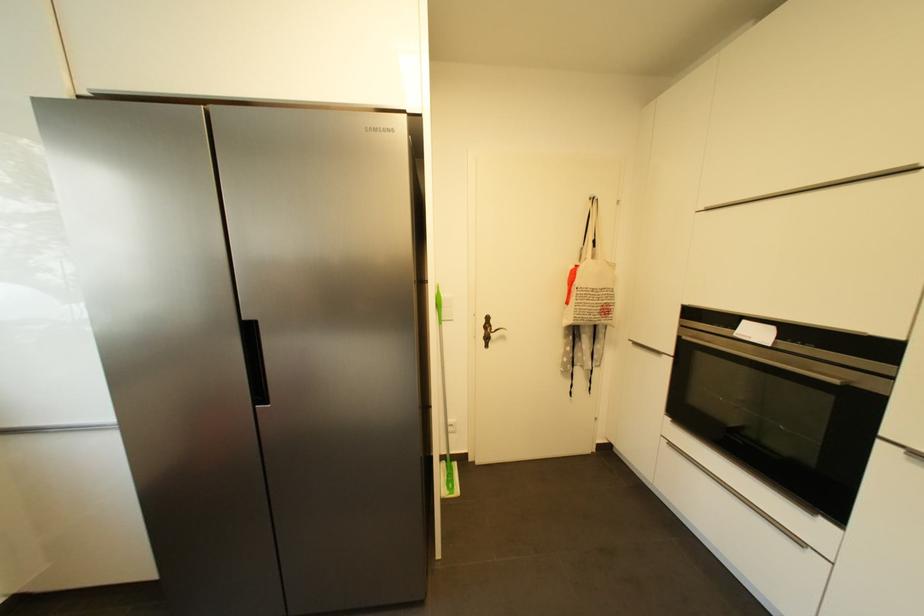
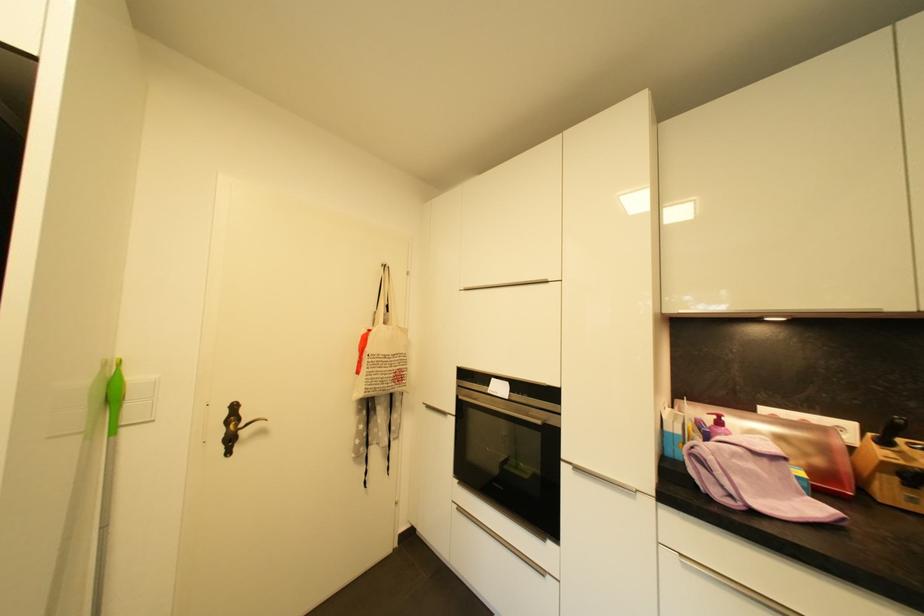
The point at (611, 313) is marked in the first image. Where is the corresponding point in the second image?

(405, 379)